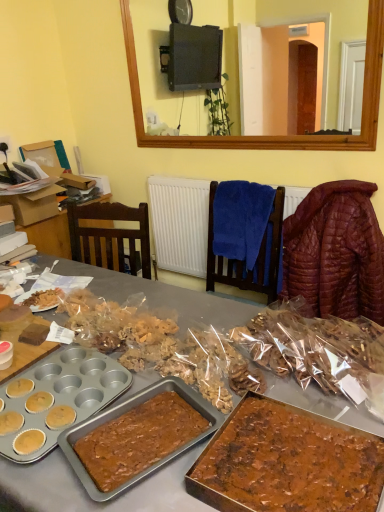
Question: Is quilted brown jacket at right directly adjacent to cardboard box at left?

Choices:
 (A) no
 (B) yes

Answer: (A)

Question: Could cardboard box at left be considered to be inside quilted brown jacket at right?

Choices:
 (A) yes
 (B) no

Answer: (B)

Question: Is quilted brown jacket at right shorter than cardboard box at left?

Choices:
 (A) yes
 (B) no

Answer: (B)

Question: From the image's perspective, is quilted brown jacket at right on cardboard box at left?

Choices:
 (A) yes
 (B) no

Answer: (B)

Question: Is quilted brown jacket at right facing away from cardboard box at left?

Choices:
 (A) no
 (B) yes

Answer: (A)

Question: Would you say quilted brown jacket at right is outside cardboard box at left?

Choices:
 (A) yes
 (B) no

Answer: (A)

Question: Does cardboard box at left contain translucent plastic cookies at center, the second snack when ordered from left to right?

Choices:
 (A) yes
 (B) no

Answer: (B)

Question: Considering the relative sizes of cardboard box at left and translucent plastic cookies at center, the second snack when ordered from left to right, in the image provided, is cardboard box at left bigger than translucent plastic cookies at center, the second snack when ordered from left to right,?

Choices:
 (A) yes
 (B) no

Answer: (A)

Question: From the image's perspective, is cardboard box at left beneath translucent plastic cookies at center, arranged as the 1th snack when viewed from the right?

Choices:
 (A) no
 (B) yes

Answer: (A)

Question: Could you tell me if cardboard box at left is turned towards translucent plastic cookies at center, arranged as the 1th snack when viewed from the right?

Choices:
 (A) no
 (B) yes

Answer: (B)

Question: Can you confirm if cardboard box at left is wider than translucent plastic cookies at center, the second snack when ordered from left to right?

Choices:
 (A) yes
 (B) no

Answer: (B)

Question: Considering the relative positions of cardboard box at left and translucent plastic cookies at center, arranged as the 1th snack when viewed from the right, in the image provided, is cardboard box at left to the right of translucent plastic cookies at center, arranged as the 1th snack when viewed from the right, from the viewer's perspective?

Choices:
 (A) yes
 (B) no

Answer: (B)

Question: Considering the relative sizes of chocolatey brown cake at lower right and translucent plastic cookies at center, arranged as the 1th snack when viewed from the right, in the image provided, is chocolatey brown cake at lower right taller than translucent plastic cookies at center, arranged as the 1th snack when viewed from the right,?

Choices:
 (A) yes
 (B) no

Answer: (B)